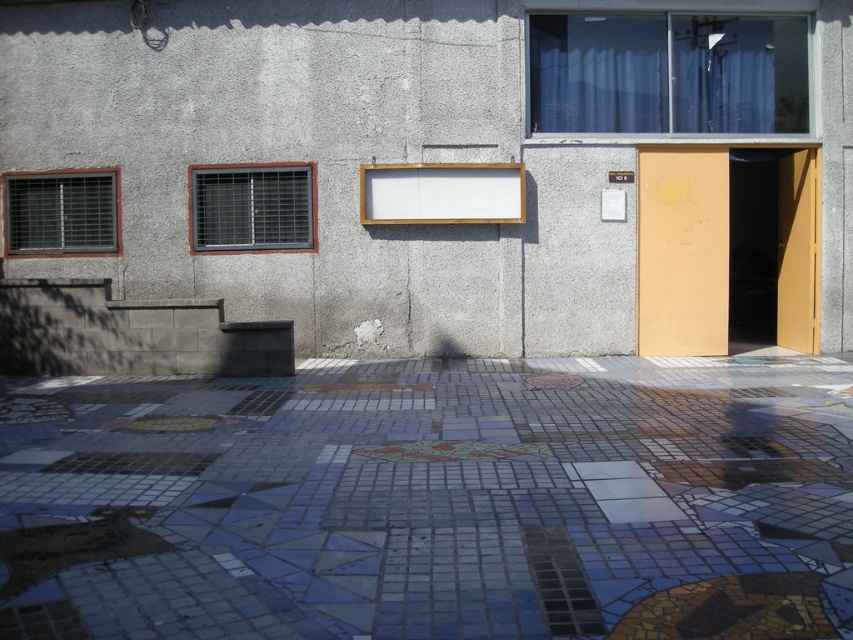
You are standing on the mosaic tile pavement at center and want to enter the matte yellow door at right. Which direction should you move to reach the door?

The mosaic tile pavement at center is positioned on the left side of the matte yellow door at right, so you should move to the right to reach the door.

You are standing on the mosaic tile pavement at center and want to enter the matte yellow door at right. Which direction should you move to reach the door?

Answer: Since the mosaic tile pavement at center is closer to the viewer than the matte yellow door at right, you should move forward towards the matte yellow door at right to reach it.